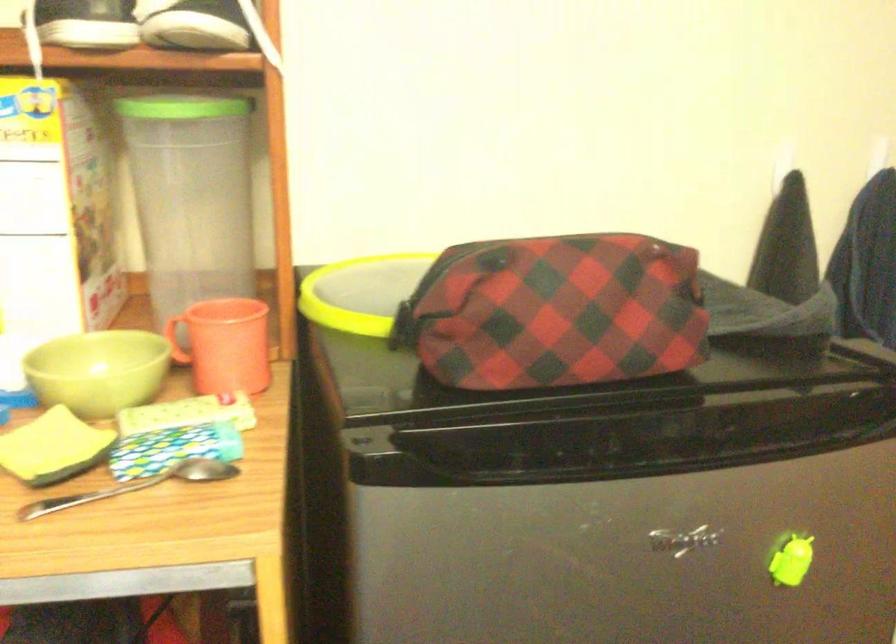
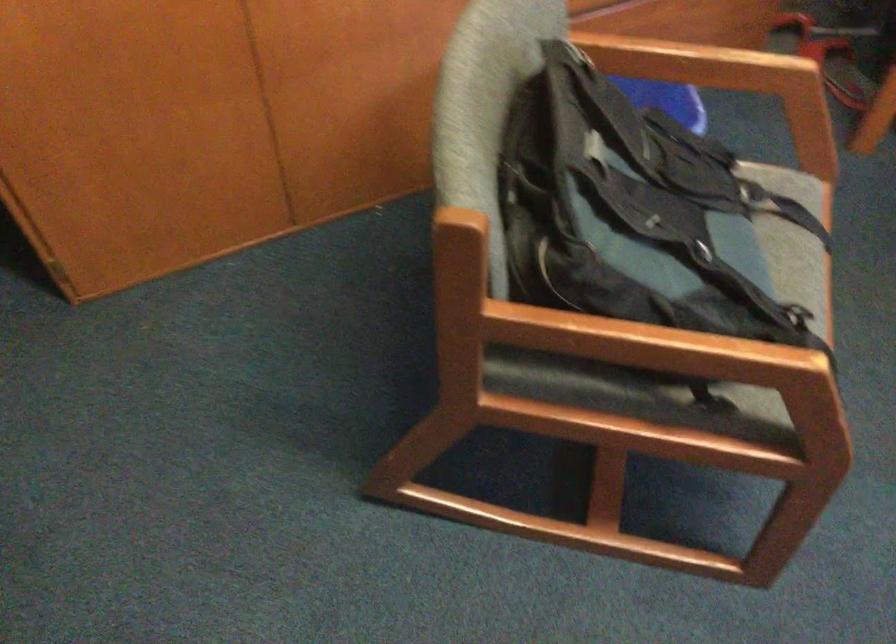
Based on the continuous images, in which direction is the camera rotating?

The camera rotated toward right-down.